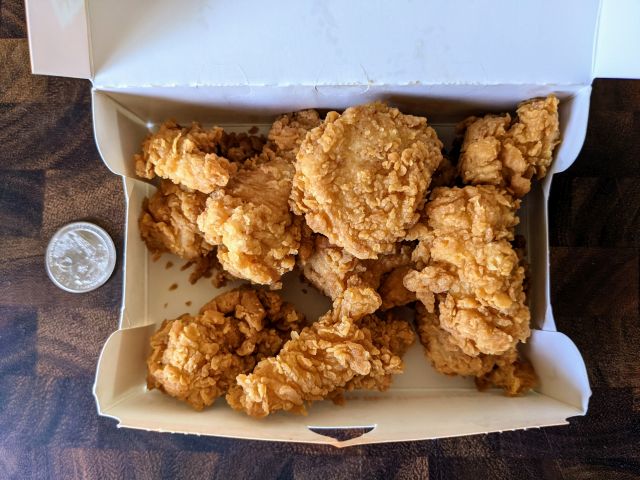
Identify the location of light wood. Image resolution: width=640 pixels, height=480 pixels. (171, 465).